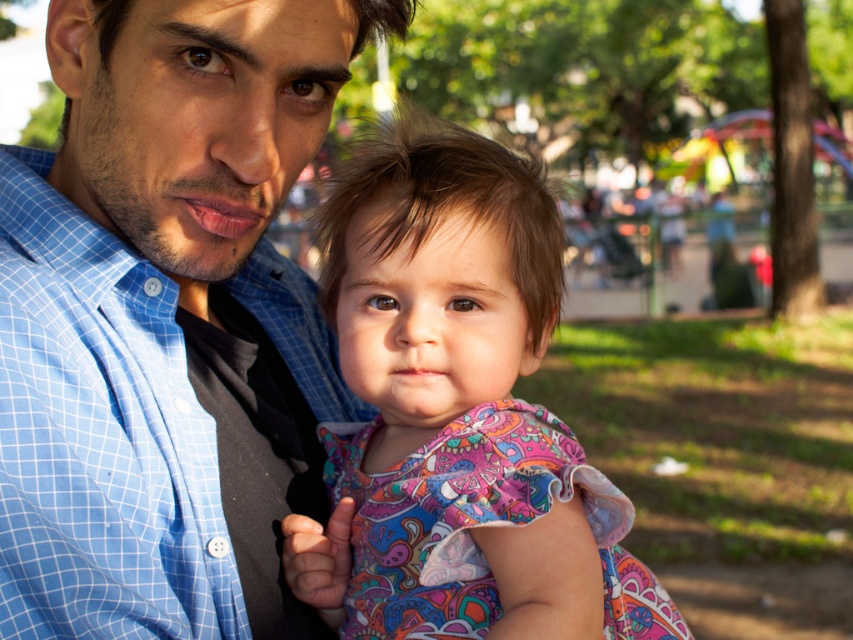
You are a photographer adjusting the focus on your camera. You want to ensure both the blue checkered shirt at center and the paisley fabric dress at center are in focus. Which object should you focus on first to achieve this?

The blue checkered shirt at center is positioned over the paisley fabric dress at center, so you should focus on the blue checkered shirt at center first to ensure both are in focus.

You are a photographer trying to capture a photo of the blue checkered shirt at center and the blue checkered shirt at left. If your camera has a maximum focus range of 4 inches, can you focus on both shirts at the same time?

The blue checkered shirt at center is 4.79 inches away from the blue checkered shirt at left, which exceeds the camera maximum focus range of 4 inches. Therefore, you cannot focus on both shirts at the same time.

You are a photographer trying to capture a photo of both the blue checkered shirt at center and the blue checkered shirt at left. Which one is taller?

The blue checkered shirt at center is taller than the blue checkered shirt at left.